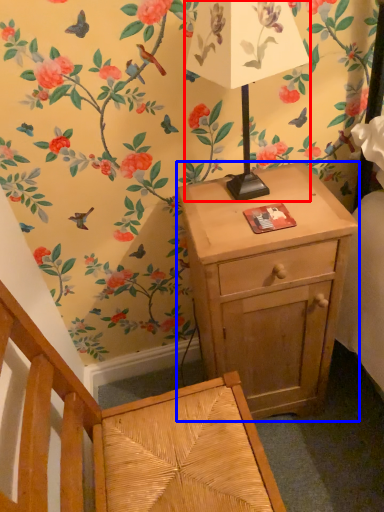
Question: Which object appears farthest to the camera in this image, table lamp (highlighted by a red box) or nightstand (highlighted by a blue box)?

Choices:
 (A) table lamp
 (B) nightstand

Answer: (B)